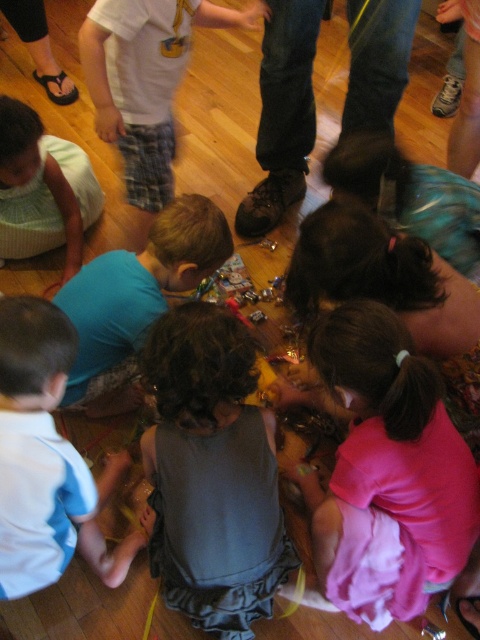
Does point (168, 493) come behind point (0, 502)?

Yes, point (168, 493) is farther from viewer.

Who is more forward, (183, 339) or (49, 461)?

Positioned in front is point (183, 339).

The width and height of the screenshot is (480, 640). Describe the element at coordinates (212, 474) in the screenshot. I see `gray fabric dress at center` at that location.

You are a GUI agent. You are given a task and a screenshot of the screen. Output one action in this format:
    pyautogui.click(x=<x>, y=<y>)
    Task: Click on the gray fabric dress at center
    
    Given the screenshot: What is the action you would take?
    pyautogui.click(x=212, y=474)

Can you confirm if gray fabric dress at center is bigger than pink fabric at lower center?

No, gray fabric dress at center is not bigger than pink fabric at lower center.

Measure the distance between gray fabric dress at center and camera.

A distance of 3.73 feet exists between gray fabric dress at center and camera.

The width and height of the screenshot is (480, 640). I want to click on gray fabric dress at center, so click(212, 474).

Between pink fabric at lower center and white cotton shirt at lower left, which one is positioned lower?

Positioned lower is pink fabric at lower center.

Can you confirm if pink fabric at lower center is positioned below white cotton shirt at lower left?

Yes.

Is point (309, 483) more distant than point (23, 330)?

That is True.

Where is `pink fabric at lower center`? This screenshot has width=480, height=640. pink fabric at lower center is located at coordinates (392, 451).